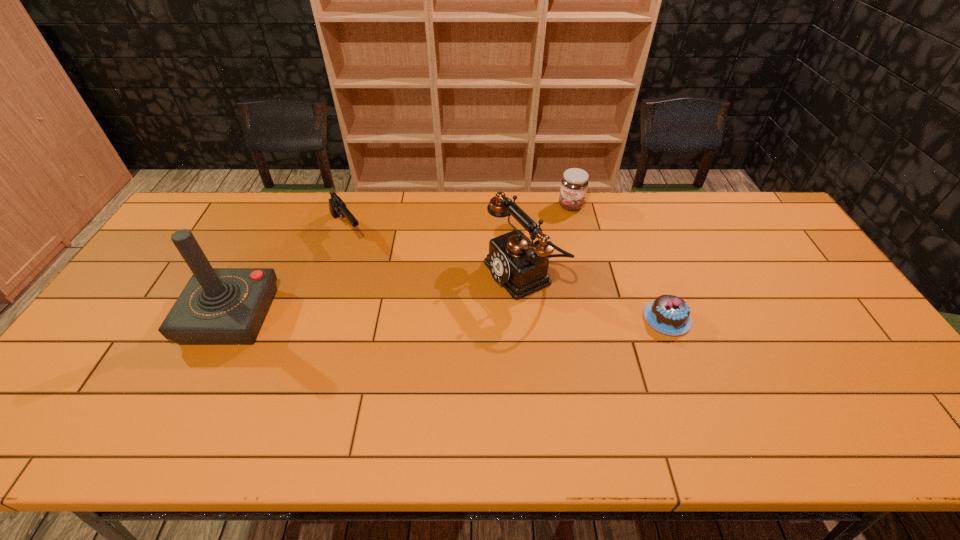
Locate an element on the screen. vacant region located on the back of the shortest object is located at coordinates (639, 246).

The image size is (960, 540). I want to click on vacant space situated 0.360m on the front of the telephone at the rotary dial, so click(x=371, y=340).

The height and width of the screenshot is (540, 960). Identify the location of blank area located on the front of the telephone at the rotary dial. (x=359, y=344).

Image resolution: width=960 pixels, height=540 pixels. In order to click on free space located on the front of the telephone at the rotary dial in this screenshot , I will do `click(399, 327)`.

Locate an element on the screen. This screenshot has height=540, width=960. vacant space located at the end of the barrel of the second object from left to right is located at coordinates (380, 279).

You are a GUI agent. You are given a task and a screenshot of the screen. Output one action in this format:
    pyautogui.click(x=<x>, y=<y>)
    Task: Click on the vacant space situated 0.240m at the end of the barrel of the second object from left to right
    
    Given the screenshot: What is the action you would take?
    pyautogui.click(x=390, y=292)

You are a GUI agent. You are given a task and a screenshot of the screen. Output one action in this format:
    pyautogui.click(x=<x>, y=<y>)
    Task: Click on the free space located 0.130m at the end of the barrel of the second object from left to right
    Image resolution: width=960 pixels, height=540 pixels.
    Given the screenshot: What is the action you would take?
    pyautogui.click(x=372, y=269)

Locate an element on the screen. Image resolution: width=960 pixels, height=540 pixels. free space located on the front label of the fourth object from left to right is located at coordinates (536, 268).

This screenshot has width=960, height=540. What are the coordinates of `free spot located on the front label of the fourth object from left to right` in the screenshot? It's located at (528, 283).

In order to click on vacant space situated 0.060m on the front label of the fourth object from left to right in this screenshot , I will do `click(562, 222)`.